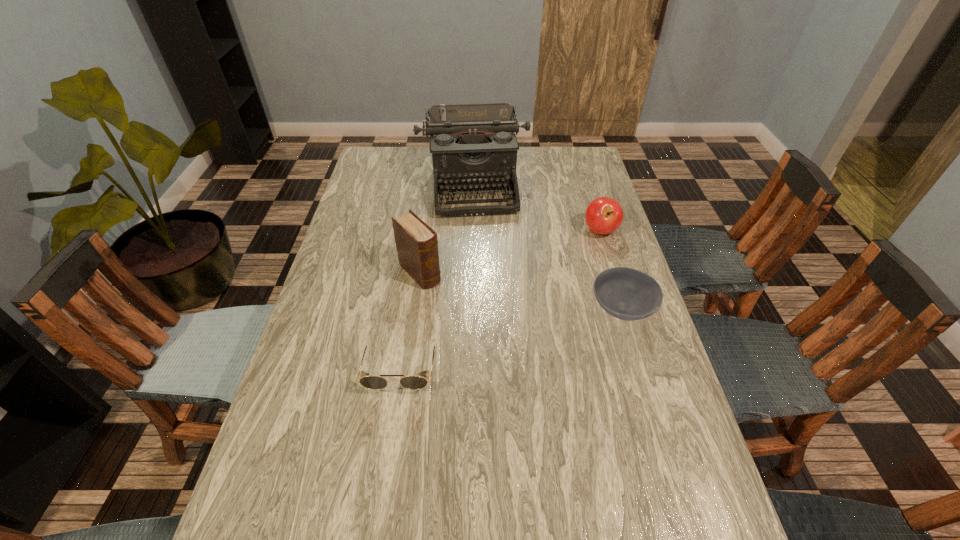
You are a GUI agent. You are given a task and a screenshot of the screen. Output one action in this format:
    pyautogui.click(x=<x>, y=<y>)
    Task: Click on the blank region between the bowl and the tallest object
    
    Given the screenshot: What is the action you would take?
    pyautogui.click(x=547, y=248)

The height and width of the screenshot is (540, 960). In order to click on free point between the tallest object and the fourth shortest object in this screenshot , I will do `click(446, 230)`.

Locate which object is the second closest to the diary. Please provide its 2D coordinates. Your answer should be formatted as a tuple, i.e. [(x, y)], where the tuple contains the x and y coordinates of a point satisfying the conditions above.

[(375, 382)]

The image size is (960, 540). In order to click on the fourth closest object to the tallest object in this screenshot , I will do `click(375, 382)`.

This screenshot has height=540, width=960. Find the location of `vacant space that satisfies the following two spatial constraints: 1. on the front side of the bowl; 2. on the right side of the second tallest object`. vacant space that satisfies the following two spatial constraints: 1. on the front side of the bowl; 2. on the right side of the second tallest object is located at coordinates (415, 309).

This screenshot has width=960, height=540. In order to click on free location that satisfies the following two spatial constraints: 1. on the back side of the third tallest object; 2. on the right side of the bowl in this screenshot , I will do `click(598, 231)`.

Find the location of `free space that satisfies the following two spatial constraints: 1. on the front side of the bowl; 2. on the right side of the second tallest object`. free space that satisfies the following two spatial constraints: 1. on the front side of the bowl; 2. on the right side of the second tallest object is located at coordinates (415, 309).

This screenshot has height=540, width=960. What are the coordinates of `free spot that satisfies the following two spatial constraints: 1. on the back side of the bowl; 2. on the left side of the apple` in the screenshot? It's located at (598, 231).